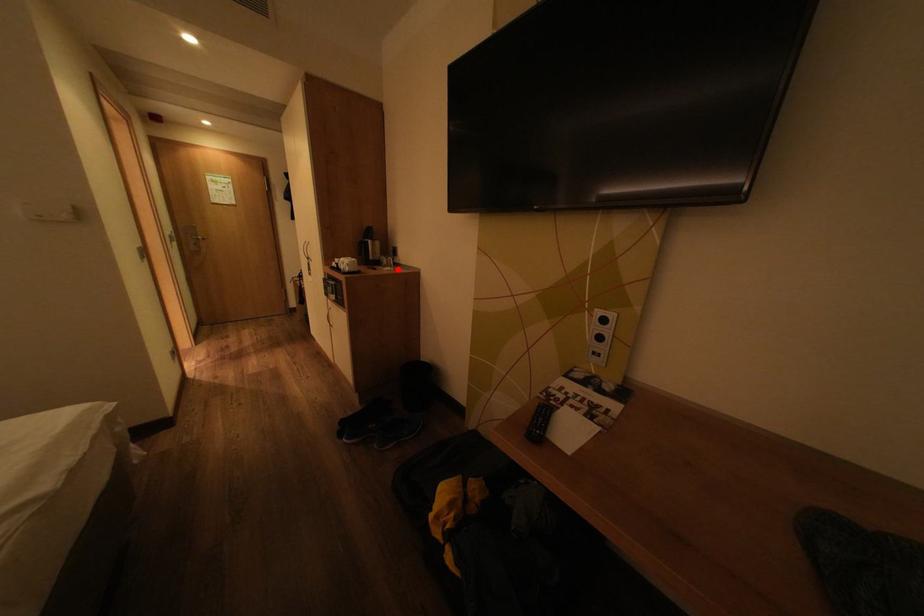
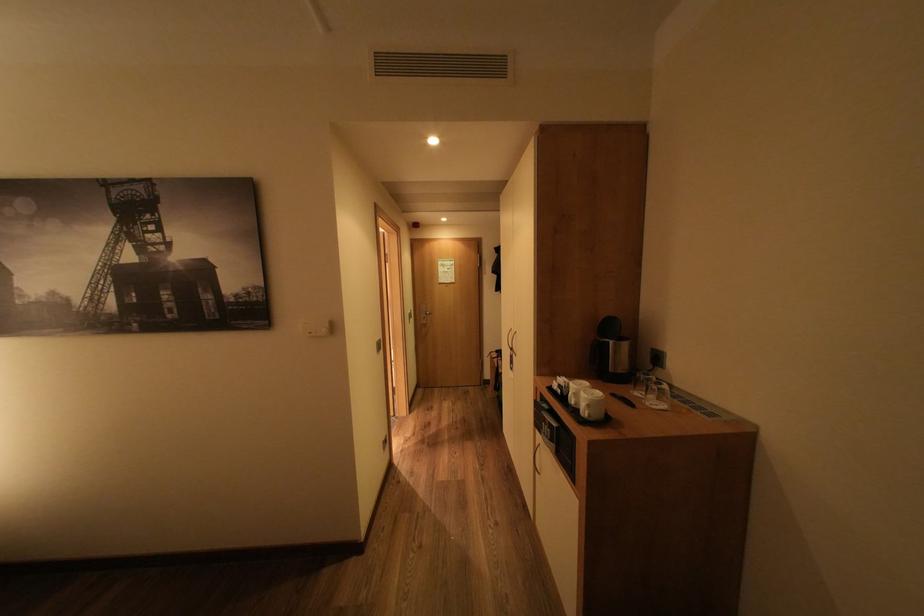
In the second image, find the point that corresponds to the highlighted location in the first image.

(664, 402)